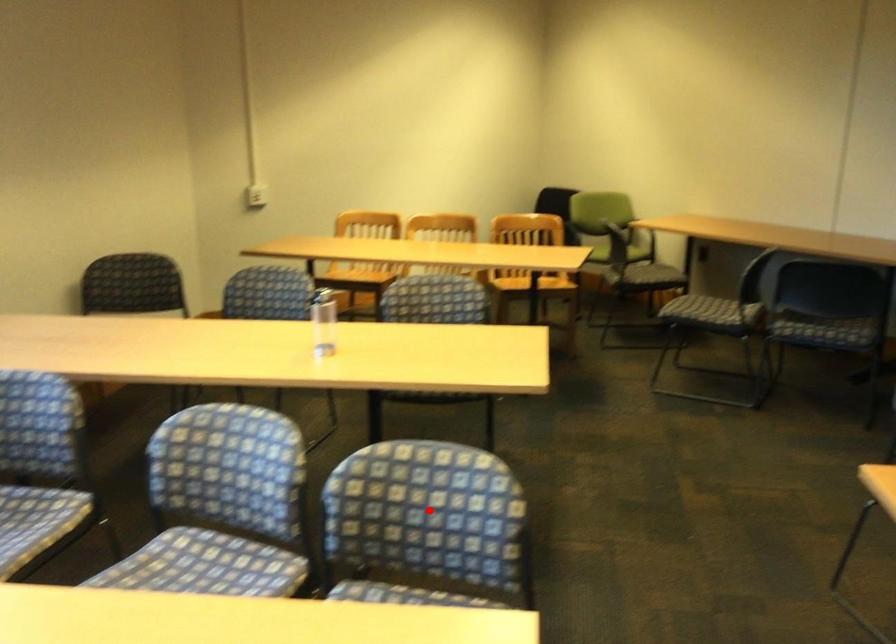
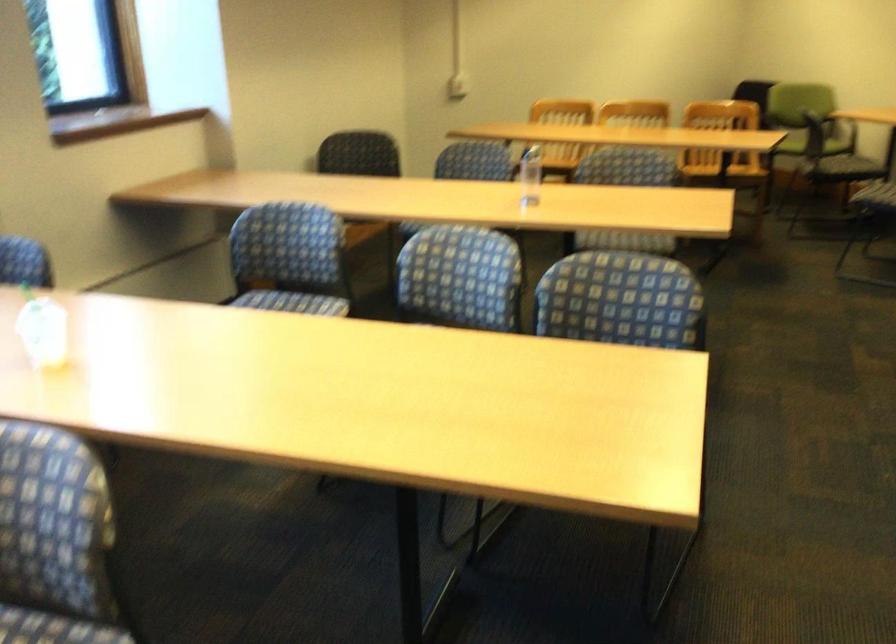
Question: I am providing you with two images of the same scene from different viewpoints. A red point is shown in image1. For the corresponding object point in image2, is it positioned nearer or farther from the camera?

Choices:
 (A) Nearer
 (B) Farther

Answer: (B)